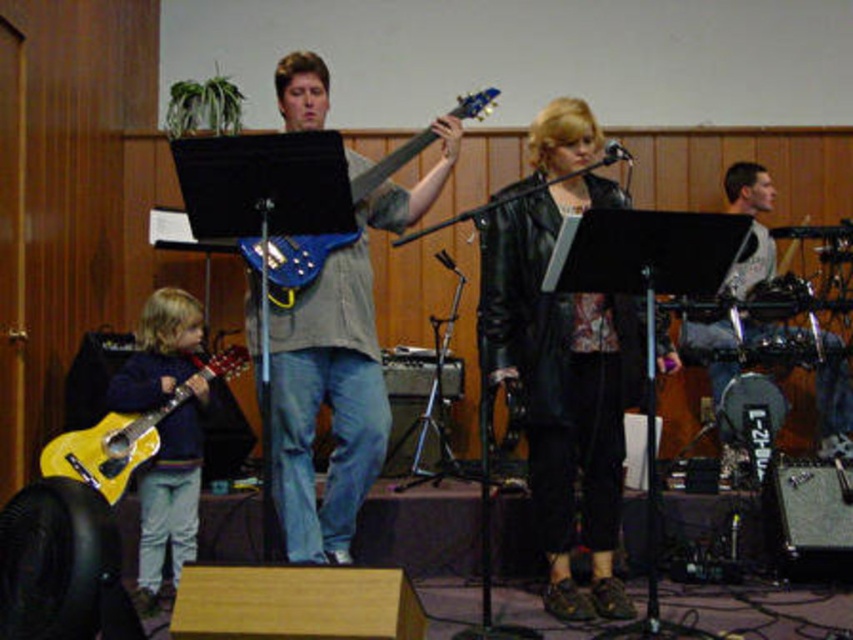
Is point (750, 198) positioned behind point (474, 97)?

Yes, point (750, 198) is farther from viewer.

Who is higher up, gray textured shirt at right or blue metallic guitar at center?

Positioned higher is blue metallic guitar at center.

The image size is (853, 640). Describe the element at coordinates (833, 408) in the screenshot. I see `gray textured shirt at right` at that location.

You are a GUI agent. You are given a task and a screenshot of the screen. Output one action in this format:
    pyautogui.click(x=<x>, y=<y>)
    Task: Click on the gray textured shirt at right
    The height and width of the screenshot is (640, 853).
    Given the screenshot: What is the action you would take?
    pyautogui.click(x=833, y=408)

Is black leather jacket at center wider than blue metallic guitar at center?

In fact, black leather jacket at center might be narrower than blue metallic guitar at center.

Measure the distance between point (x=563, y=140) and camera.

A distance of 3.53 meters exists between point (x=563, y=140) and camera.

Where is `black leather jacket at center`? Image resolution: width=853 pixels, height=640 pixels. black leather jacket at center is located at coordinates (561, 358).

Image resolution: width=853 pixels, height=640 pixels. Find the location of `black leather jacket at center`. black leather jacket at center is located at coordinates (561, 358).

Between shiny blue guitar at center and yellow matte guitar at lower left, which one appears on the right side from the viewer's perspective?

shiny blue guitar at center

From the picture: Does shiny blue guitar at center come behind yellow matte guitar at lower left?

No, it is not.

What do you see at coordinates (337, 378) in the screenshot?
I see `shiny blue guitar at center` at bounding box center [337, 378].

At what (x,y) coordinates should I click in order to perform the action: click on shiny blue guitar at center. Please return your answer as a coordinate pair (x, y). This screenshot has width=853, height=640. Looking at the image, I should click on (337, 378).